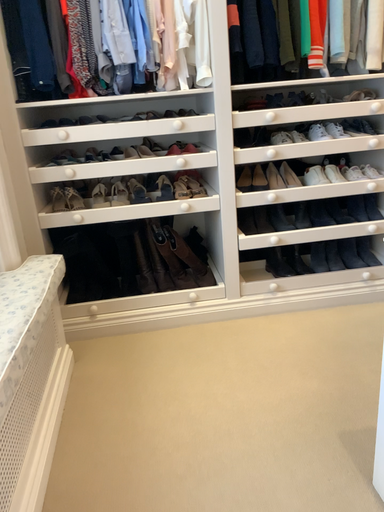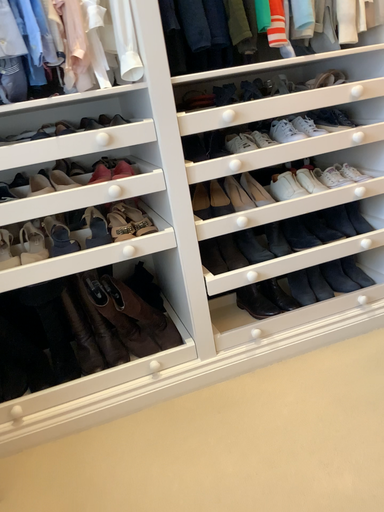
Question: Which way did the camera rotate in the video?

Choices:
 (A) rotated right
 (B) rotated left

Answer: (A)